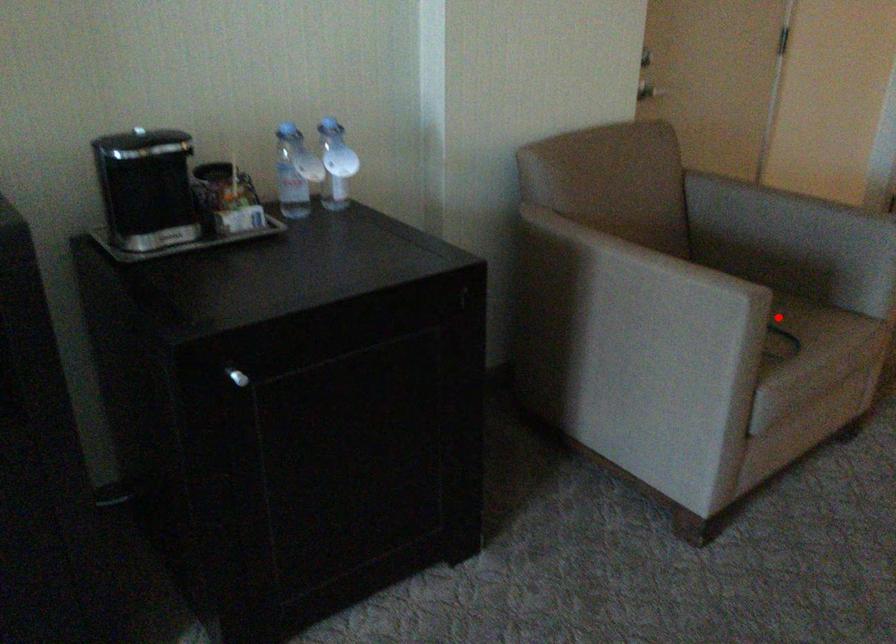
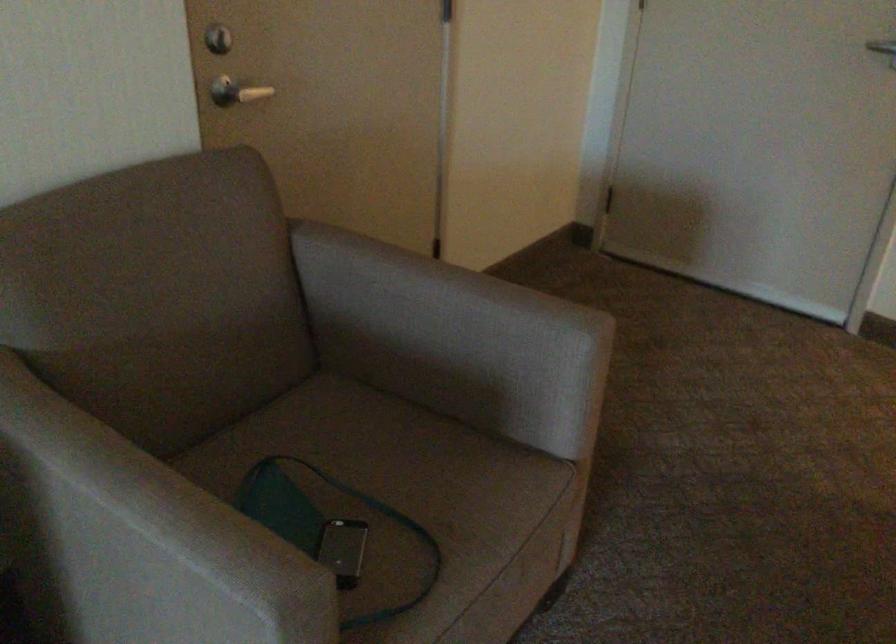
Question: I am providing you with two images of the same scene from different viewpoints. A red point is shown in image1. For the corresponding object point in image2, is it positioned nearer or farther from the camera?

Choices:
 (A) Nearer
 (B) Farther

Answer: (A)